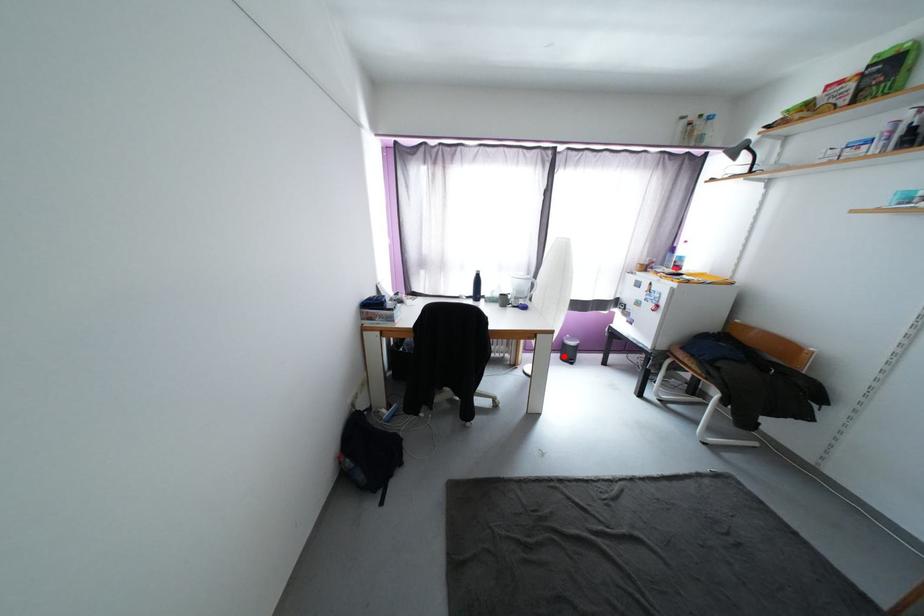
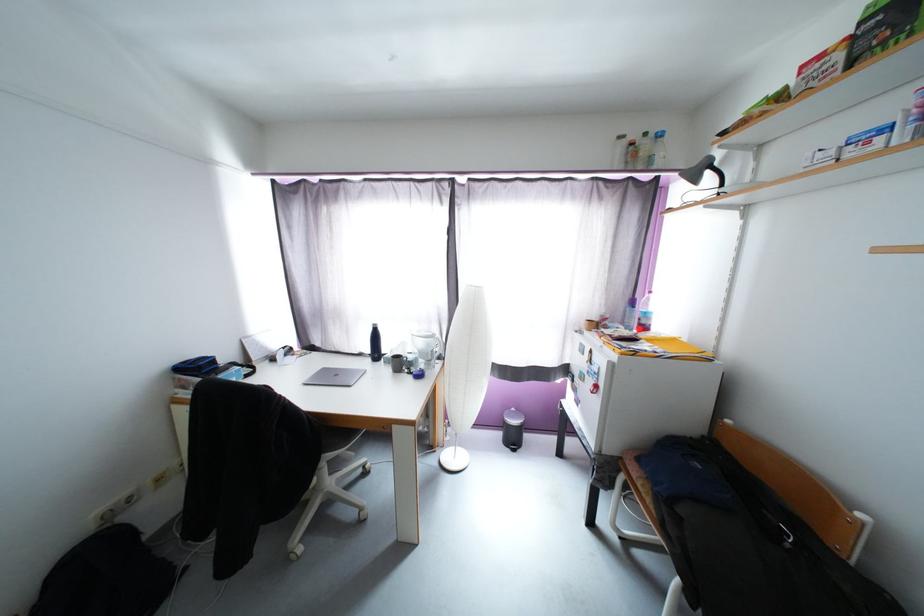
Question: I am providing you with two images of the same scene from different viewpoints. Given a red point in image1, look at the same physical point in image2. Is it:

Choices:
 (A) Closer to the viewpoint
 (B) Farther from the viewpoint

Answer: (A)